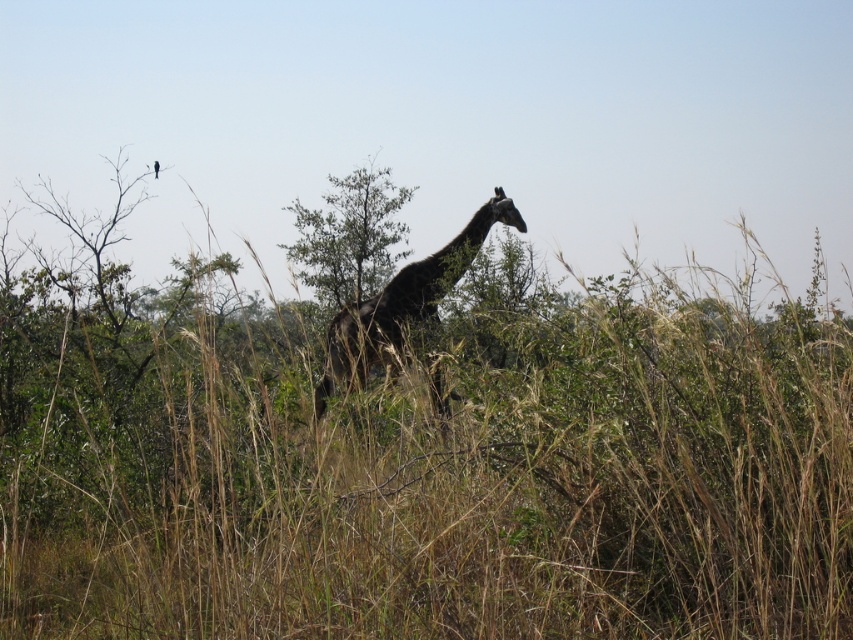
You are a wildlife photographer aiming to capture the giraffe in the savanna scene. You notice a point at coordinates [403,305]. What object is located at this point?

The point at coordinates [403,305] corresponds to the dark brown textured giraffe at center.

You are a photographer trying to capture a photo of the dark brown textured giraffe at center and the green leafy tree at center. You want to ensure both are in focus. Given that your camera can only focus on objects within a 30 inch range, will both subjects be in focus?

The dark brown textured giraffe at center and green leafy tree at center are 37.69 inches apart. Since the distance between them exceeds the camera focus range of 30 inches, both subjects cannot be in focus simultaneously.

You are a photographer trying to capture a photo of the dark brown textured giraffe at center and the green leafy tree at center. Since the giraffe is bigger than the tree, which one will appear closer to the camera in the photo?

The dark brown textured giraffe at center is bigger than the green leafy tree at center, so it will appear closer to the camera in the photo.